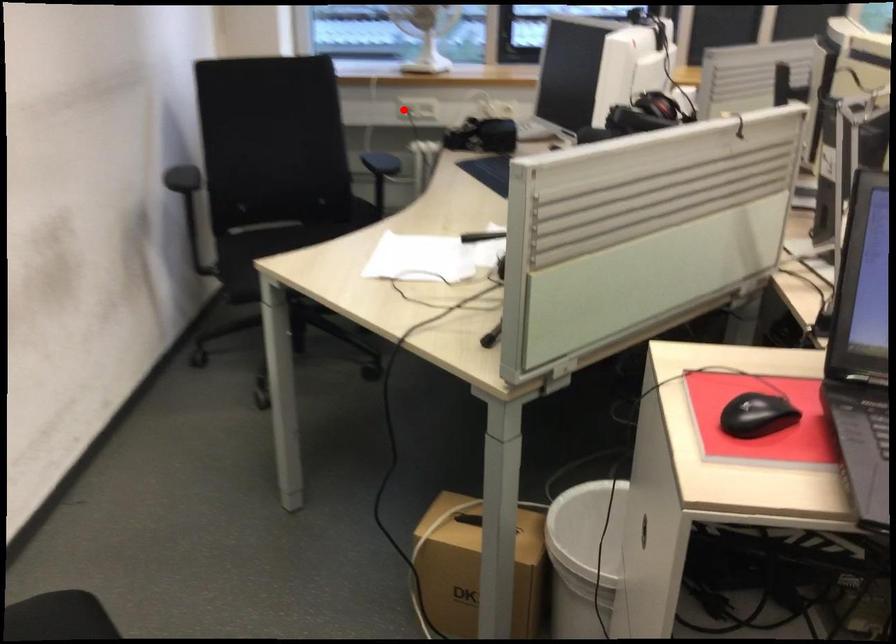
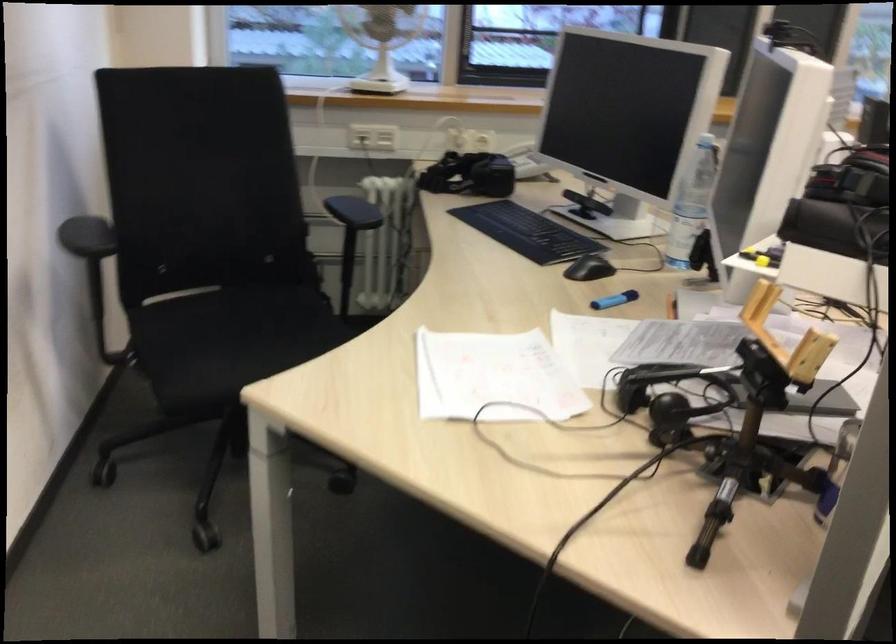
Find the pixel in the second image that matches the highlighted location in the first image.

(358, 138)